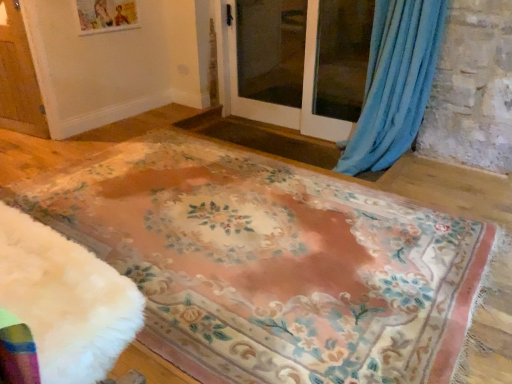
Question: Is wooden screen door at left, arranged as the 3th screen door when viewed from the right, bigger or smaller than transparent glass screen door at center, placed as the 1th screen door when sorted from right to left?

Choices:
 (A) small
 (B) big

Answer: (A)

Question: Is wooden screen door at left, arranged as the 3th screen door when viewed from the right, spatially inside transparent glass screen door at center, placed as the 1th screen door when sorted from right to left, or outside of it?

Choices:
 (A) inside
 (B) outside

Answer: (B)

Question: Based on their relative distances, which object is nearer to the wooden screen door at left, placed as the first screen door when sorted from left to right?

Choices:
 (A) transparent glass screen door at center, placed as the 1th screen door when sorted from right to left
 (B) blue soft fabric curtain at upper right
 (C) floral-patterned carpet at center
 (D) clear glass screen door at center, the second screen door when ordered from left to right

Answer: (C)

Question: Based on their relative distances, which object is nearer to the transparent glass screen door at center, placed as the third screen door when sorted from left to right?

Choices:
 (A) clear glass screen door at center, the second screen door when ordered from left to right
 (B) wooden screen door at left, placed as the first screen door when sorted from left to right
 (C) floral-patterned carpet at center
 (D) blue soft fabric curtain at upper right

Answer: (A)